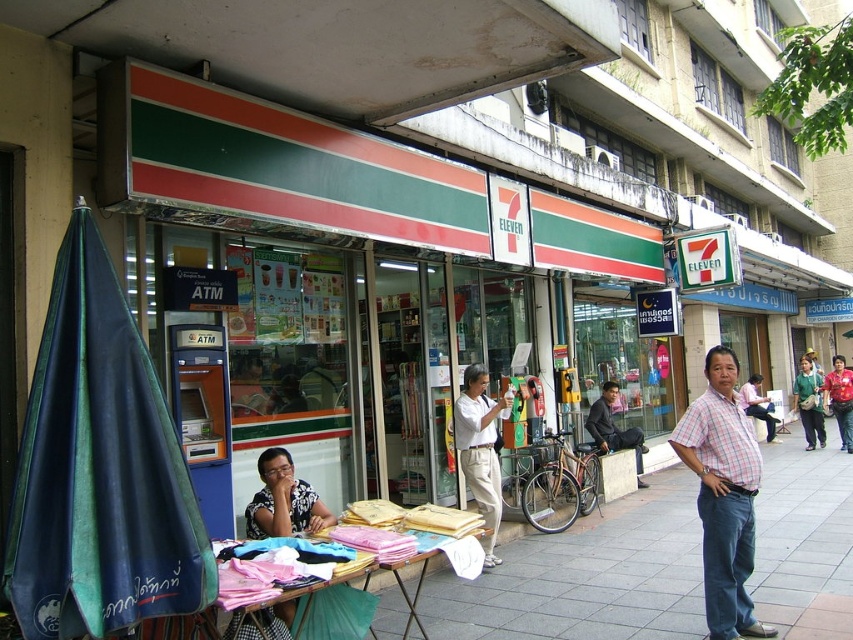
You are a delivery person standing at the entrance of the 7 Eleven store. You need to place a package on the plaid shirt at center. Where exactly should you place it?

The plaid shirt at center is located at coordinates point (723, 496), so you should place the package there.

You are standing at the point labeled as point [708,483] and want to walk to the point labeled as point [814,412]. Which direction should you move relative to your current position?

To reach point [814,412] from point [708,483], you should move backward since point [708,483] is in front of point [814,412].

You are standing at the point labeled point (27, 426) and want to walk to the point labeled point (677, 628). According to the scene, will you have to walk towards the 7 Eleven store or away from it?

Since point (27, 426) is in front of point (677, 628), you would have to walk away from the 7 Eleven store to reach point (677, 628) from your current position at point (27, 426).